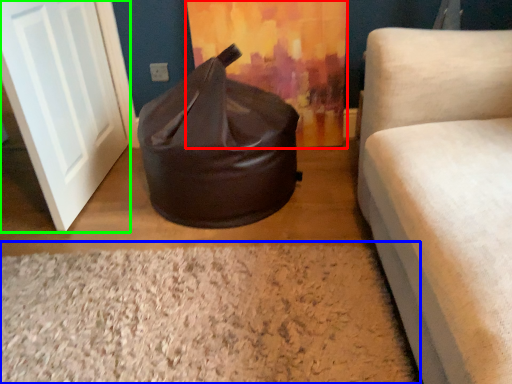
Question: Considering the real-world distances, which object is closest to curtain (highlighted by a red box)? granite (highlighted by a blue box) or door (highlighted by a green box).

Choices:
 (A) granite
 (B) door

Answer: (B)